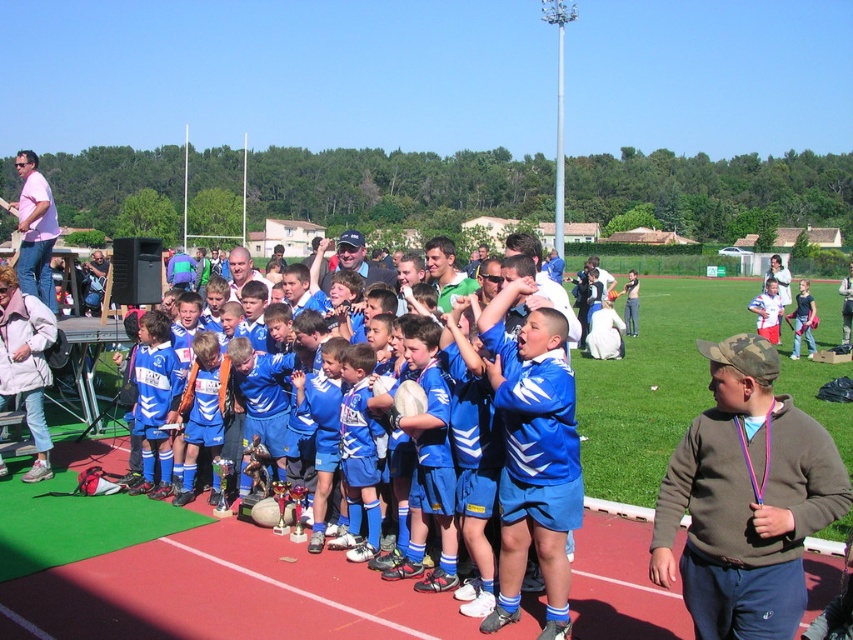
Question: Which of the following is the closest to the observer?

Choices:
 (A) pyautogui.click(x=521, y=404)
 (B) pyautogui.click(x=709, y=541)

Answer: (B)

Question: Which point is closer to the camera taking this photo?

Choices:
 (A) (650, 545)
 (B) (421, 436)

Answer: (A)

Question: Does brown fleece sweatshirt at lower right have a greater width compared to blue jersey at center?

Choices:
 (A) yes
 (B) no

Answer: (B)

Question: Which point is closer to the camera?

Choices:
 (A) brown fleece sweatshirt at lower right
 (B) blue jersey at center

Answer: (A)

Question: Is brown fleece sweatshirt at lower right thinner than blue jersey at center?

Choices:
 (A) no
 (B) yes

Answer: (B)

Question: Is brown fleece sweatshirt at lower right wider than blue jersey at center?

Choices:
 (A) yes
 (B) no

Answer: (B)